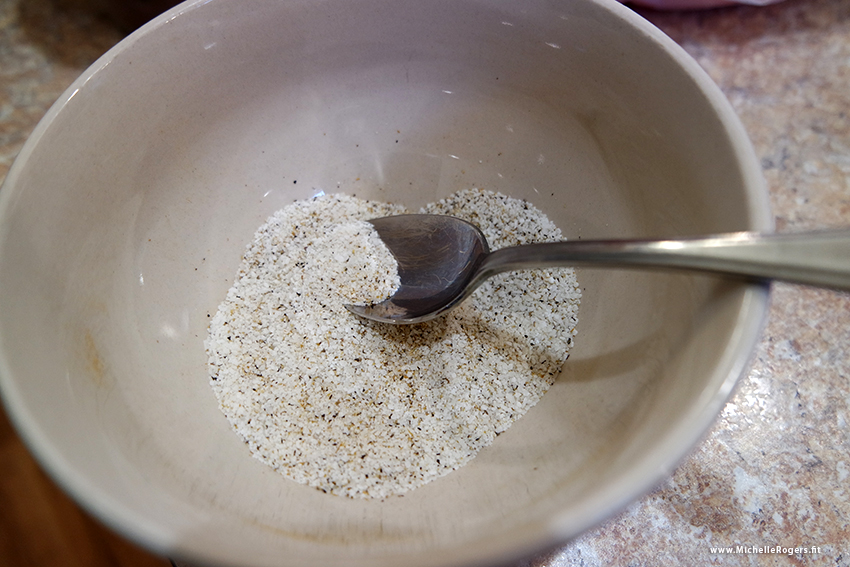
The image size is (850, 567). What are the coordinates of `bowl` in the screenshot? It's located at (683, 361).